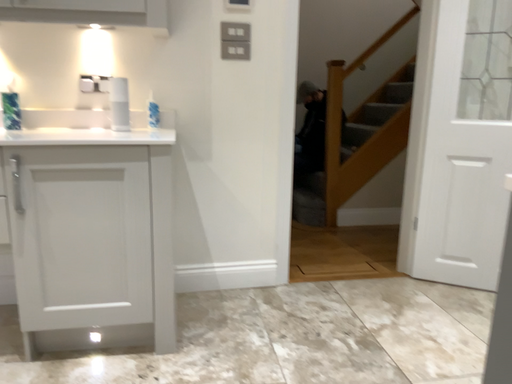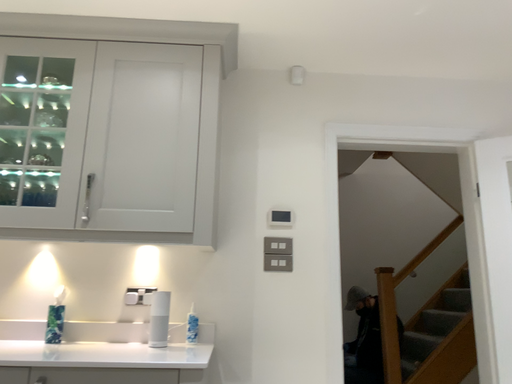
Question: Which way did the camera rotate in the video?

Choices:
 (A) rotated upward
 (B) rotated downward

Answer: (A)